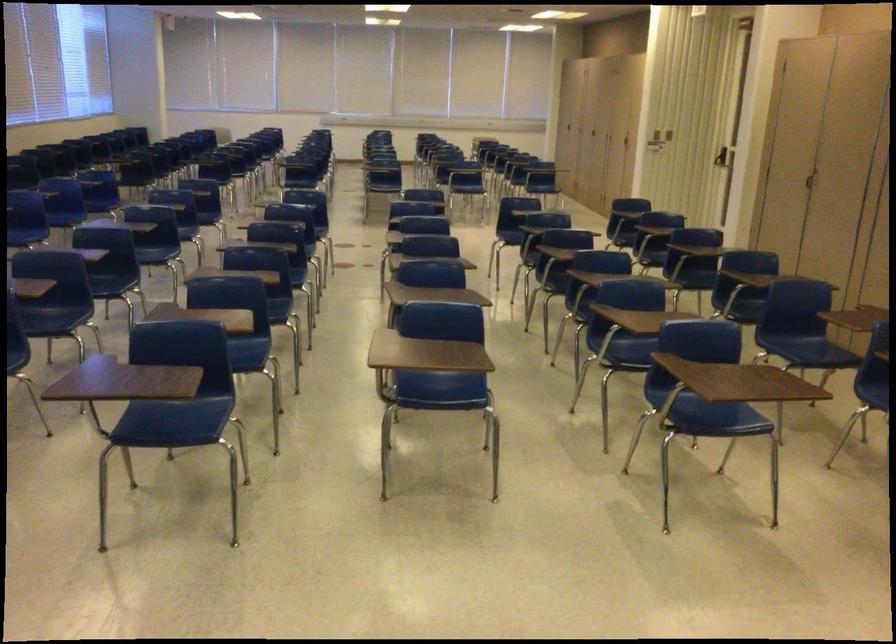
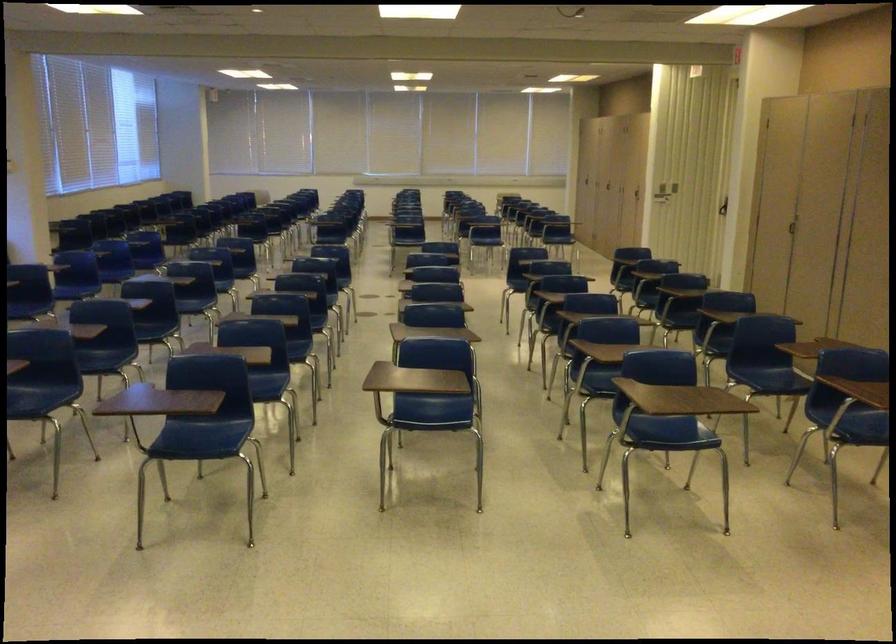
In the second image, find the point that corresponds to (x=177, y=413) in the first image.

(203, 436)